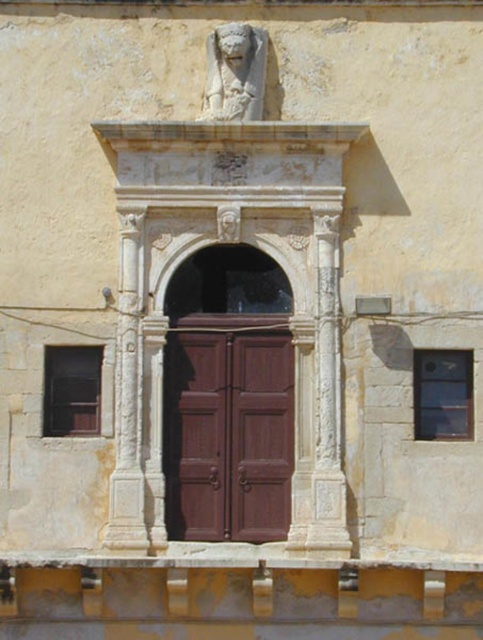
You are standing at the entrance of the historical building and want to walk towards the door. Which point, point (193, 525) or point (51, 392), is closer to the door?

Result: Point (193, 525) is closer to the door because it is in front of point (51, 392).

You are standing at the entrance of the historical building and want to enter. There is a white stone lion at upper center and a dark glass window at left. Which object is positioned higher relative to the other?

The white stone lion at upper center is located above the dark glass window at left, so it is positioned higher.